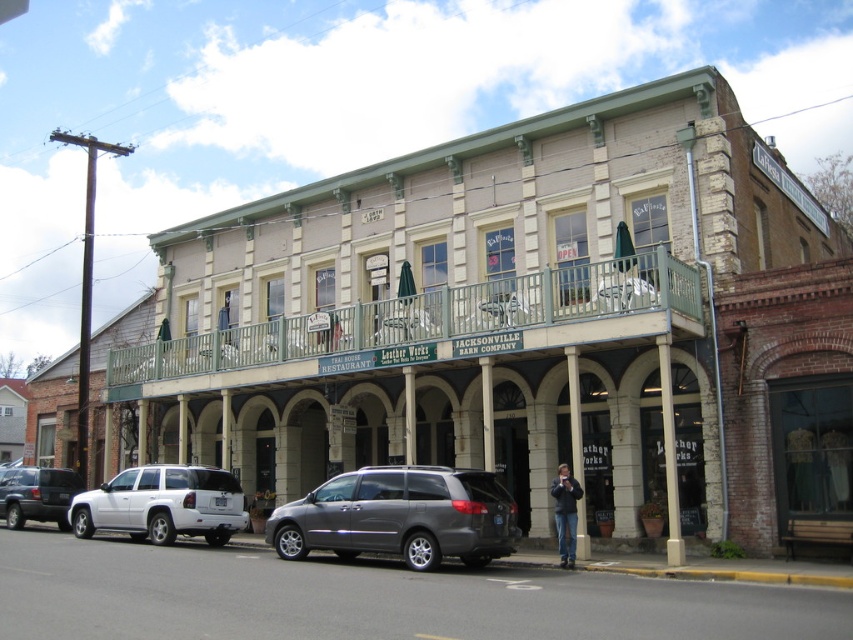
Question: Where is green metal railing at upper center located in relation to white matte suv at lower left in the image?

Choices:
 (A) left
 (B) right

Answer: (B)

Question: Is white matte suv at lower left below matte black suv at lower left?

Choices:
 (A) no
 (B) yes

Answer: (A)

Question: Which object is closer to the camera taking this photo?

Choices:
 (A) green metal railing at upper center
 (B) white matte suv at lower left

Answer: (A)

Question: Can you confirm if green metal railing at upper center is bigger than metallic gray minivan at center?

Choices:
 (A) yes
 (B) no

Answer: (A)

Question: Which point is closer to the camera?

Choices:
 (A) (494, 497)
 (B) (628, 262)

Answer: (A)

Question: Which point appears farthest from the camera in this image?

Choices:
 (A) (20, 467)
 (B) (183, 520)
 (C) (622, 266)
 (D) (413, 548)

Answer: (A)